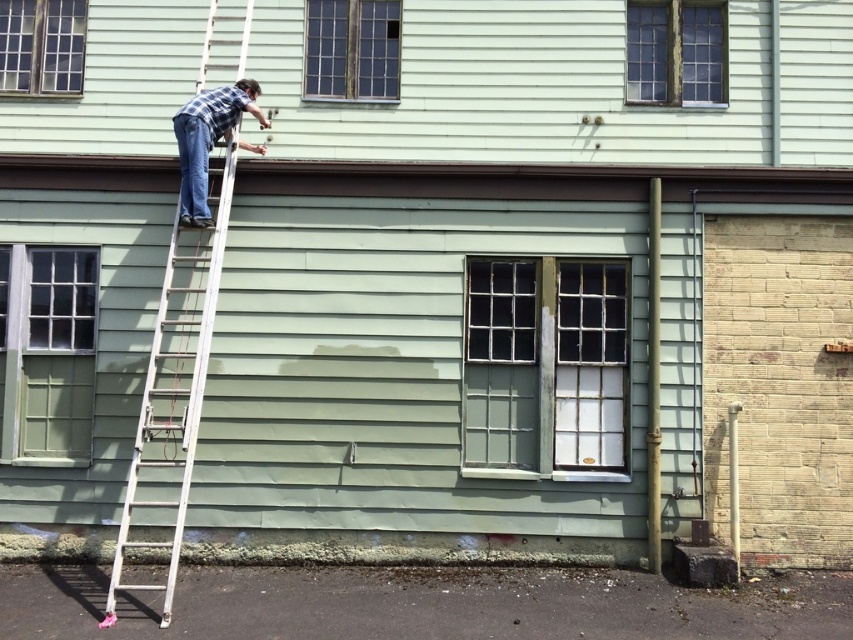
How distant is matte green window at lower left from wooden grid window at upper center?

matte green window at lower left and wooden grid window at upper center are 2.91 meters apart from each other.

Where is `matte green window at lower left`? matte green window at lower left is located at coordinates (48, 355).

What do you see at coordinates (48, 355) in the screenshot? I see `matte green window at lower left` at bounding box center [48, 355].

You are a GUI agent. You are given a task and a screenshot of the screen. Output one action in this format:
    pyautogui.click(x=<x>, y=<y>)
    Task: Click on the matte green window at lower left
    
    Given the screenshot: What is the action you would take?
    pyautogui.click(x=48, y=355)

Between white metallic ladder at left and plaid flannel shirt at upper center, which one is positioned higher?

plaid flannel shirt at upper center is higher up.

I want to click on white metallic ladder at left, so click(177, 374).

The width and height of the screenshot is (853, 640). Identify the location of white metallic ladder at left. (177, 374).

Does point (180, 401) come behind point (701, 86)?

No, it is not.

Identify the location of white metallic ladder at left. The height and width of the screenshot is (640, 853). click(177, 374).